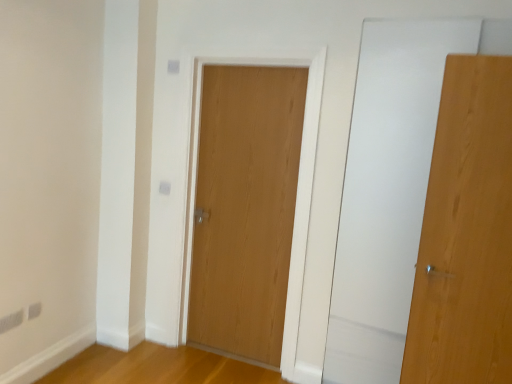
Question: Considering their positions, is light oak wood door at center, which is the 2th door from front to back, located in front of or behind natural wood door at right, acting as the 1th door starting from the front?

Choices:
 (A) front
 (B) behind

Answer: (B)

Question: Considering the positions of light oak wood door at center, which is the 2th door from front to back, and natural wood door at right, the second door positioned from the back, in the image, is light oak wood door at center, which is the 2th door from front to back, bigger or smaller than natural wood door at right, the second door positioned from the back,?

Choices:
 (A) big
 (B) small

Answer: (A)

Question: From the image's perspective, is light oak wood door at center, which is the 2th door from front to back, located above or below natural wood door at right, the second door positioned from the back?

Choices:
 (A) above
 (B) below

Answer: (A)

Question: From the image's perspective, is natural wood door at right, acting as the 1th door starting from the front, located above or below light oak wood door at center, which is the 2th door from front to back?

Choices:
 (A) above
 (B) below

Answer: (B)

Question: From a real-world perspective, is natural wood door at right, acting as the 1th door starting from the front, positioned above or below light oak wood door at center, placed as the first door when sorted from back to front?

Choices:
 (A) below
 (B) above

Answer: (B)

Question: Visually, is natural wood door at right, which appears as the 1th door when viewed from the right, positioned to the left or to the right of light oak wood door at center, placed as the first door when sorted from back to front?

Choices:
 (A) left
 (B) right

Answer: (B)

Question: Considering their positions, is natural wood door at right, placed as the 2th door when sorted from left to right, located in front of or behind light oak wood door at center, which is the 2th door from front to back?

Choices:
 (A) front
 (B) behind

Answer: (A)